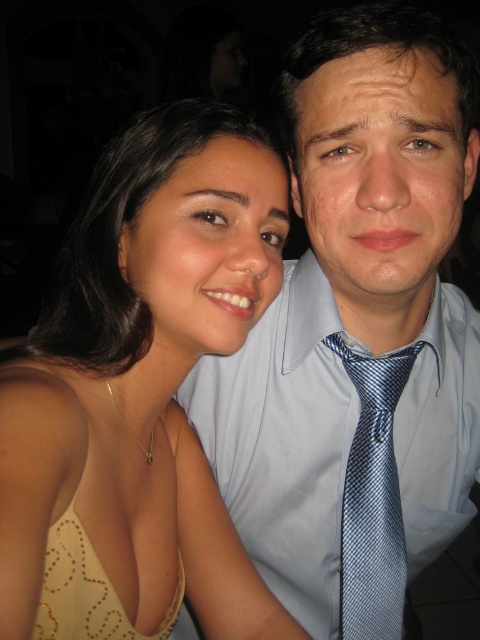
Question: Considering the relative positions of light blue silk shirt at upper right and gold sequined dress at upper left in the image provided, where is light blue silk shirt at upper right located with respect to gold sequined dress at upper left?

Choices:
 (A) left
 (B) right

Answer: (B)

Question: Which of the following is the farthest from the observer?

Choices:
 (A) light blue silk shirt at upper right
 (B) blue silk tie at center

Answer: (B)

Question: Which of the following is the farthest from the observer?

Choices:
 (A) gold sequined dress at upper left
 (B) light blue silk shirt at upper right
 (C) gold metallic dress at center
 (D) blue silk tie at center

Answer: (D)

Question: Does gold metallic dress at center come in front of blue silk tie at center?

Choices:
 (A) no
 (B) yes

Answer: (B)

Question: Which object is the closest to the gold metallic dress at center?

Choices:
 (A) light blue silk shirt at upper right
 (B) blue silk tie at center
 (C) gold sequined dress at upper left

Answer: (C)

Question: Is light blue silk shirt at upper right below gold sequined dress at upper left?

Choices:
 (A) no
 (B) yes

Answer: (A)